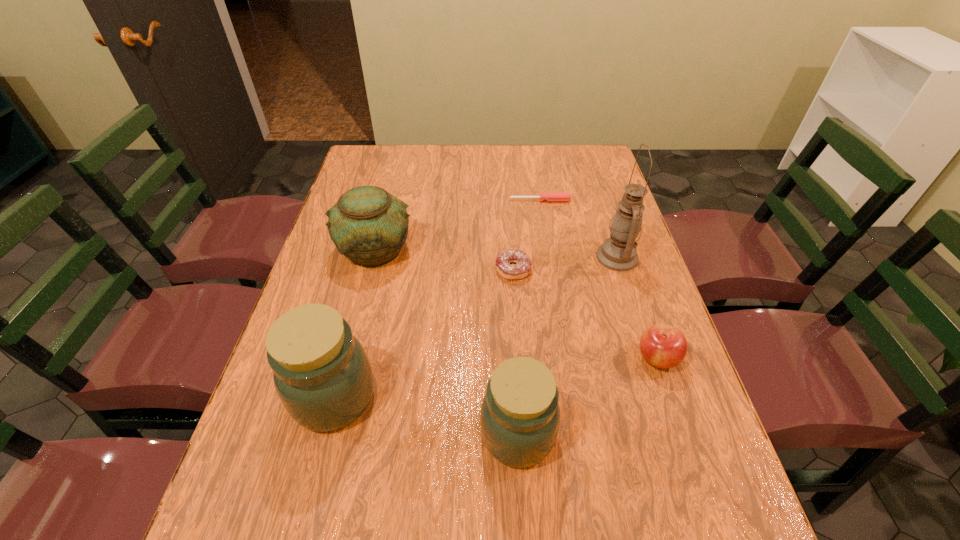
Find the location of a particular element. This screenshot has height=540, width=960. the taller jar is located at coordinates (322, 375).

Image resolution: width=960 pixels, height=540 pixels. Find the location of `the second tallest object`. the second tallest object is located at coordinates (322, 375).

This screenshot has width=960, height=540. What are the coordinates of `the shorter jar` in the screenshot? It's located at (520, 415).

The width and height of the screenshot is (960, 540). I want to click on doughnut, so click(521, 269).

At what (x,y) coordinates should I click in order to perform the action: click on screwdriver. Please return your answer as a coordinate pair (x, y). Image resolution: width=960 pixels, height=540 pixels. Looking at the image, I should click on (550, 196).

In order to click on the shortest object in this screenshot , I will do `click(550, 196)`.

You are a GUI agent. You are given a task and a screenshot of the screen. Output one action in this format:
    pyautogui.click(x=<x>, y=<y>)
    Task: Click on the tallest object
    The height and width of the screenshot is (540, 960).
    Given the screenshot: What is the action you would take?
    pyautogui.click(x=619, y=252)

Identify the location of pottery. The width and height of the screenshot is (960, 540). (368, 225).

Where is `apple`? This screenshot has width=960, height=540. apple is located at coordinates click(x=664, y=346).

Image resolution: width=960 pixels, height=540 pixels. In order to click on vacant space located on the right of the left jar in this screenshot , I will do pos(414,397).